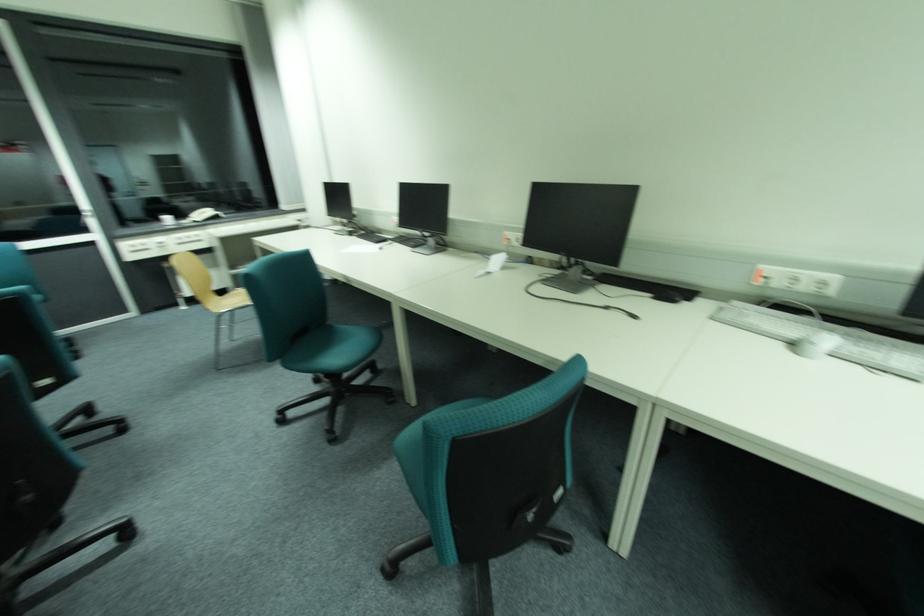
Find where to slid the white computer mouse. Please return your answer as a coordinate pair (x, y).

(816, 344)